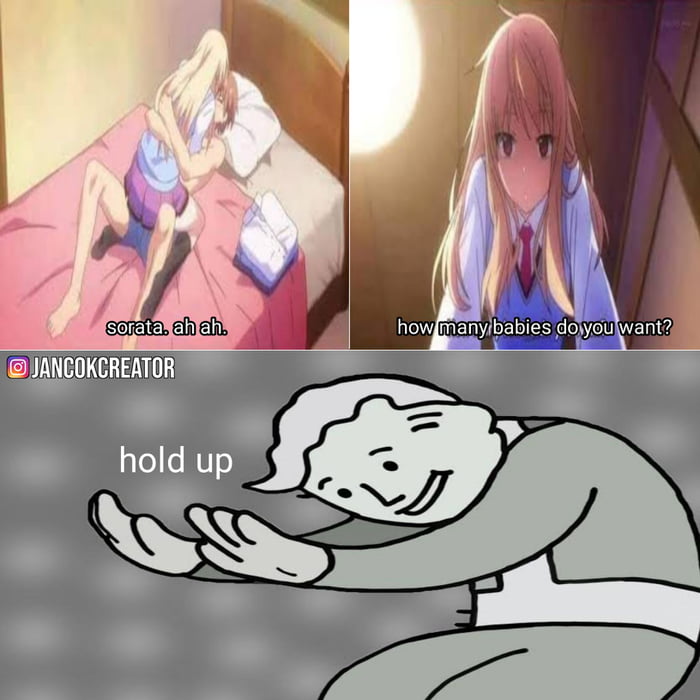
You are a GUI agent. You are given a task and a screenshot of the screen. Output one action in this format:
    pyautogui.click(x=<x>, y=<y>)
    Task: Click on the bed
    
    Given the screenshot: What is the action you would take?
    pyautogui.click(x=287, y=188)